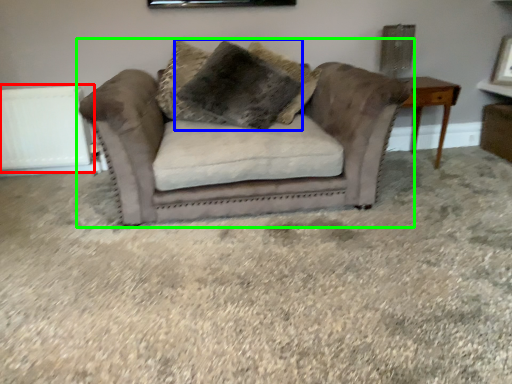
Question: Which is nearer to the radiator (highlighted by a red box)? pillow (highlighted by a blue box) or studio couch (highlighted by a green box).

Choices:
 (A) pillow
 (B) studio couch

Answer: (A)